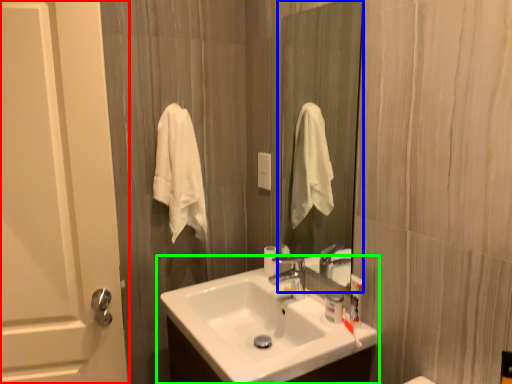
Question: Based on their relative distances, which object is farther from door (highlighted by a red box)? Choose from mirror (highlighted by a blue box) and sink (highlighted by a green box).

Choices:
 (A) mirror
 (B) sink

Answer: (A)